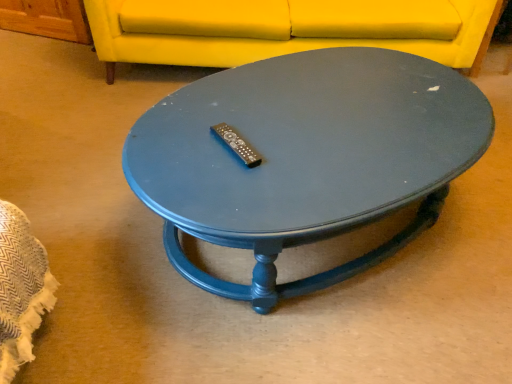
Question: Considering the positions of point (310, 102) and point (209, 54), is point (310, 102) closer or farther from the camera than point (209, 54)?

Choices:
 (A) closer
 (B) farther

Answer: (A)

Question: Would you say matte blue coffee table at center is to the left or to the right of matte yellow fabric couch at upper center in the picture?

Choices:
 (A) right
 (B) left

Answer: (A)

Question: From the image's perspective, is matte blue coffee table at center located above or below matte yellow fabric couch at upper center?

Choices:
 (A) above
 (B) below

Answer: (B)

Question: Relative to matte blue coffee table at center, is matte yellow fabric couch at upper center in front or behind?

Choices:
 (A) behind
 (B) front

Answer: (A)

Question: Is matte yellow fabric couch at upper center bigger or smaller than matte blue coffee table at center?

Choices:
 (A) big
 (B) small

Answer: (A)

Question: In terms of height, does matte yellow fabric couch at upper center look taller or shorter compared to matte blue coffee table at center?

Choices:
 (A) short
 (B) tall

Answer: (B)

Question: Looking at their shapes, would you say matte yellow fabric couch at upper center is wider or thinner than matte blue coffee table at center?

Choices:
 (A) wide
 (B) thin

Answer: (A)